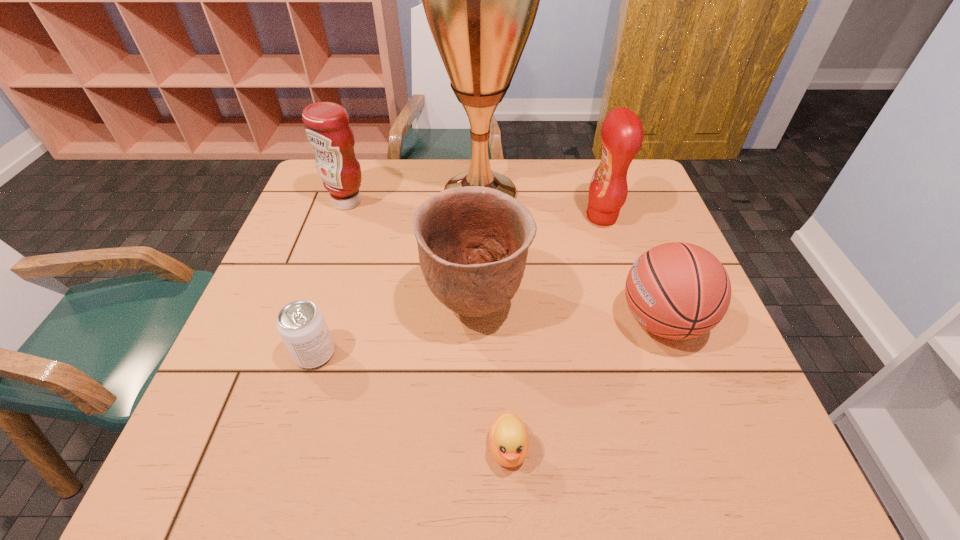
Where is `trophy cup`? trophy cup is located at coordinates (480, 0).

The width and height of the screenshot is (960, 540). Identify the location of the right condiment. (622, 133).

This screenshot has width=960, height=540. What are the coordinates of `the left condiment` in the screenshot? It's located at (327, 127).

Locate an element on the screen. pottery is located at coordinates (473, 241).

Image resolution: width=960 pixels, height=540 pixels. I want to click on the fifth tallest object, so click(x=677, y=290).

This screenshot has height=540, width=960. Identify the location of soda can. (301, 324).

The image size is (960, 540). I want to click on the nearest object, so click(x=508, y=438).

Find the location of a particular element. This screenshot has width=960, height=540. the shortest object is located at coordinates (508, 438).

In order to click on vacant space located on the front of the trophy cup in this screenshot , I will do `click(480, 288)`.

I want to click on free space located 0.340m on the label side of the right condiment, so click(463, 217).